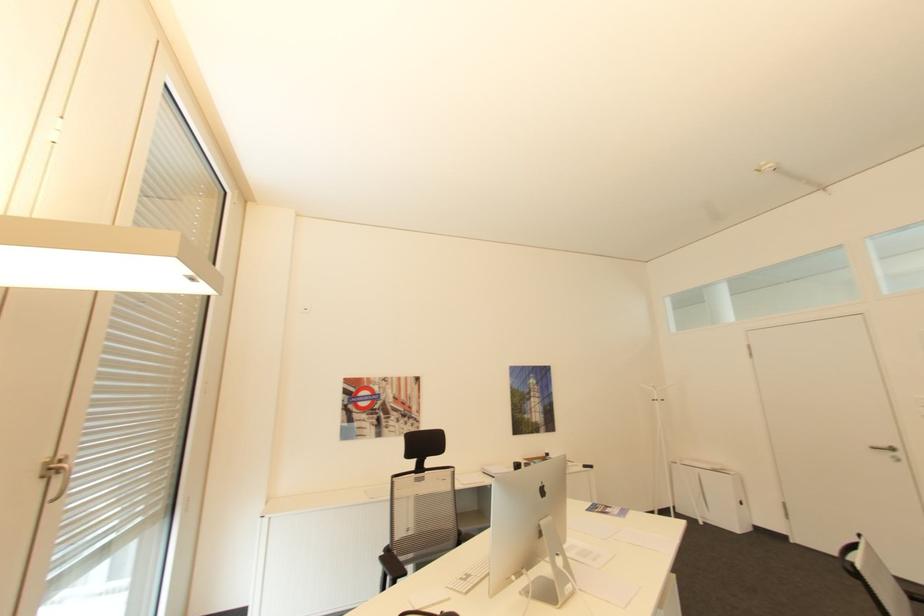
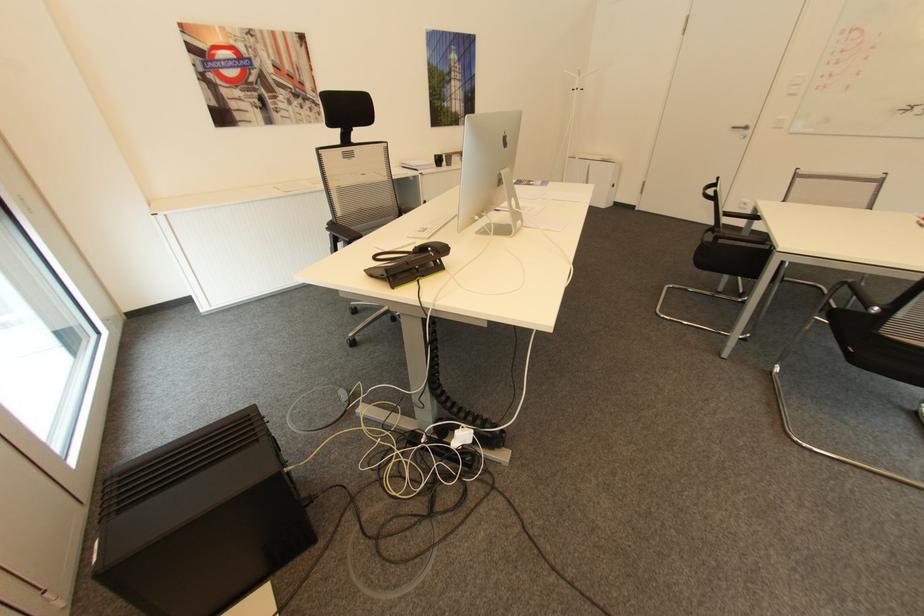
The first image is from the beginning of the video and the second image is from the end. How did the camera likely rotate when shooting the video?

The camera rotated toward right-down.